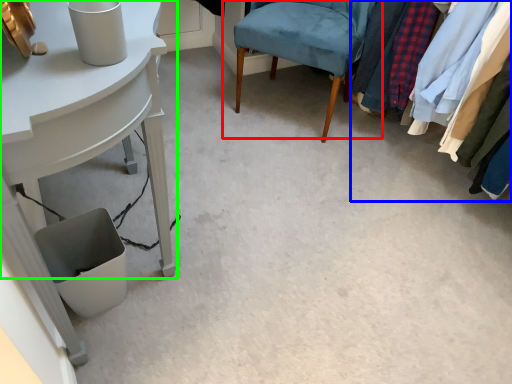
Question: Based on their relative distances, which object is nearer to chair (highlighted by a red box)? Choose from closet (highlighted by a blue box) and table (highlighted by a green box).

Choices:
 (A) closet
 (B) table

Answer: (A)